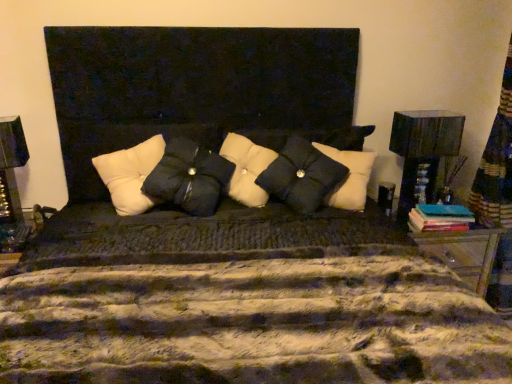
Identify the location of blank space above teal matte book at right (from a real-world perspective). (442, 207).